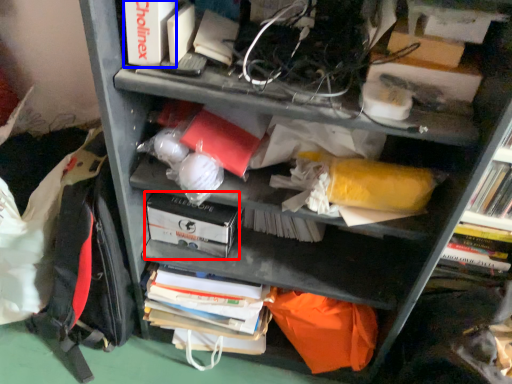
Question: Which of the following is the closest to the observer, paperback book (highlighted by a red box) or paperback book (highlighted by a blue box)?

Choices:
 (A) paperback book
 (B) paperback book

Answer: (B)